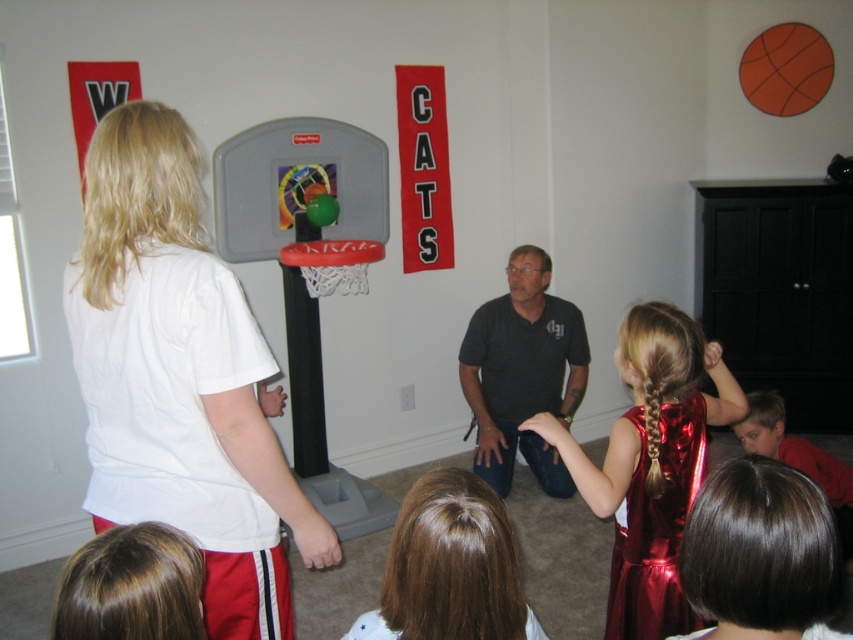
Question: Which object appears closest to the camera in this image?

Choices:
 (A) matte plastic basketball hoop at center
 (B) shiny dark brown hair at lower right
 (C) dark gray shirt at center
 (D) shiny red dress at center

Answer: (B)

Question: Which object is farther from the camera taking this photo?

Choices:
 (A) orange matte basketball at upper right
 (B) shiny red dress at center
 (C) dark gray shirt at center
 (D) shiny dark brown hair at lower right

Answer: (A)

Question: Can you confirm if matte plastic basketball hoop at center is positioned above dark gray shirt at center?

Choices:
 (A) yes
 (B) no

Answer: (A)

Question: Is matte plastic basketball hoop at center to the right of orange matte basketball at upper right from the viewer's perspective?

Choices:
 (A) yes
 (B) no

Answer: (B)

Question: Is shiny red dress at center thinner than brown shiny hair at lower center?

Choices:
 (A) no
 (B) yes

Answer: (A)

Question: Which point is farther to the camera?

Choices:
 (A) orange matte basketball at upper right
 (B) brown shiny hair at lower center
 (C) matte plastic basketball hoop at center

Answer: (A)